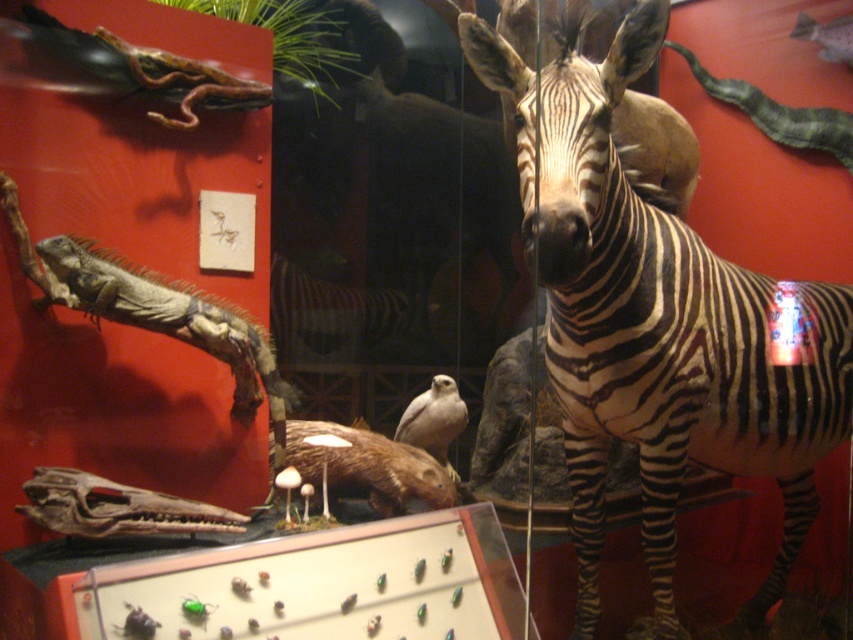
You are standing in front of a museum exhibit and see the black and white striped zebra at center. Can you tell me the exact coordinates of where the zebra is positioned?

The black and white striped zebra at center is positioned at coordinates point (656,324).

You are standing in front of a museum exhibit. You see a zebra and a mounted lizard displayed on a red wall. Where is the point at coordinates (656, 324) located in relation to the zebra and the mounted lizard?

The point at coordinates (656, 324) corresponds to the black and white striped zebra at center, so it is located on the zebra and not near the mounted lizard.